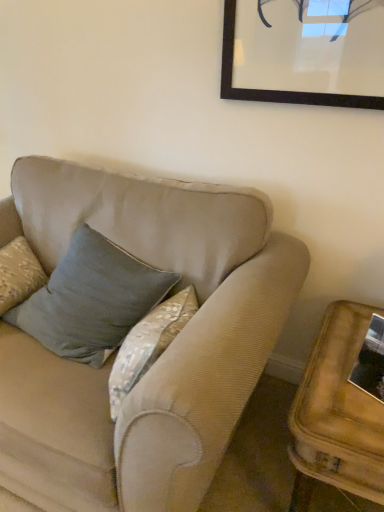
Question: Is there a large distance between wooden side table at lower right and metallic reflective frame at lower right?

Choices:
 (A) no
 (B) yes

Answer: (A)

Question: Is wooden side table at lower right behind metallic reflective frame at lower right?

Choices:
 (A) yes
 (B) no

Answer: (B)

Question: Is wooden side table at lower right thinner than metallic reflective frame at lower right?

Choices:
 (A) yes
 (B) no

Answer: (B)

Question: Is metallic reflective frame at lower right inside wooden side table at lower right?

Choices:
 (A) yes
 (B) no

Answer: (B)

Question: Considering the relative positions of wooden side table at lower right and metallic reflective frame at lower right in the image provided, is wooden side table at lower right to the left of metallic reflective frame at lower right from the viewer's perspective?

Choices:
 (A) yes
 (B) no

Answer: (A)

Question: Based on their positions, is metallic reflective frame at lower right located to the left or right of wooden side table at lower right?

Choices:
 (A) left
 (B) right

Answer: (B)

Question: From the image's perspective, relative to wooden side table at lower right, is metallic reflective frame at lower right above or below?

Choices:
 (A) below
 (B) above

Answer: (B)

Question: Is metallic reflective frame at lower right taller or shorter than wooden side table at lower right?

Choices:
 (A) tall
 (B) short

Answer: (B)

Question: Is point (372, 394) positioned closer to the camera than point (301, 433)?

Choices:
 (A) closer
 (B) farther

Answer: (B)

Question: Is metallic reflective frame at lower right wider or thinner than velvet blue pillow at center?

Choices:
 (A) wide
 (B) thin

Answer: (B)

Question: Is metallic reflective frame at lower right taller or shorter than velvet blue pillow at center?

Choices:
 (A) tall
 (B) short

Answer: (B)

Question: Looking at the image, does metallic reflective frame at lower right seem bigger or smaller compared to velvet blue pillow at center?

Choices:
 (A) small
 (B) big

Answer: (A)

Question: Visually, is metallic reflective frame at lower right positioned to the left or to the right of velvet blue pillow at center?

Choices:
 (A) left
 (B) right

Answer: (B)

Question: Is wooden side table at lower right in front of or behind metallic reflective frame at lower right in the image?

Choices:
 (A) behind
 (B) front

Answer: (B)

Question: From the image's perspective, relative to metallic reflective frame at lower right, is wooden side table at lower right above or below?

Choices:
 (A) below
 (B) above

Answer: (A)